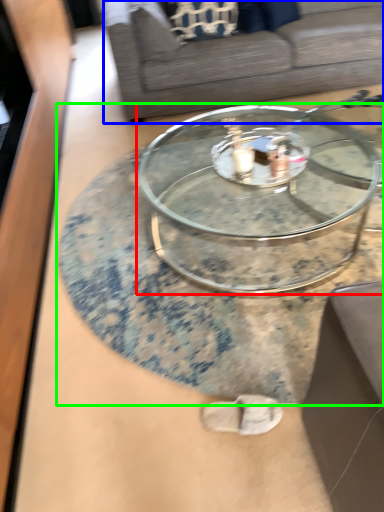
Question: Which is farther away from coffee table (highlighted by a red box)? studio couch (highlighted by a blue box) or coffee table (highlighted by a green box)?

Choices:
 (A) studio couch
 (B) coffee table

Answer: (A)